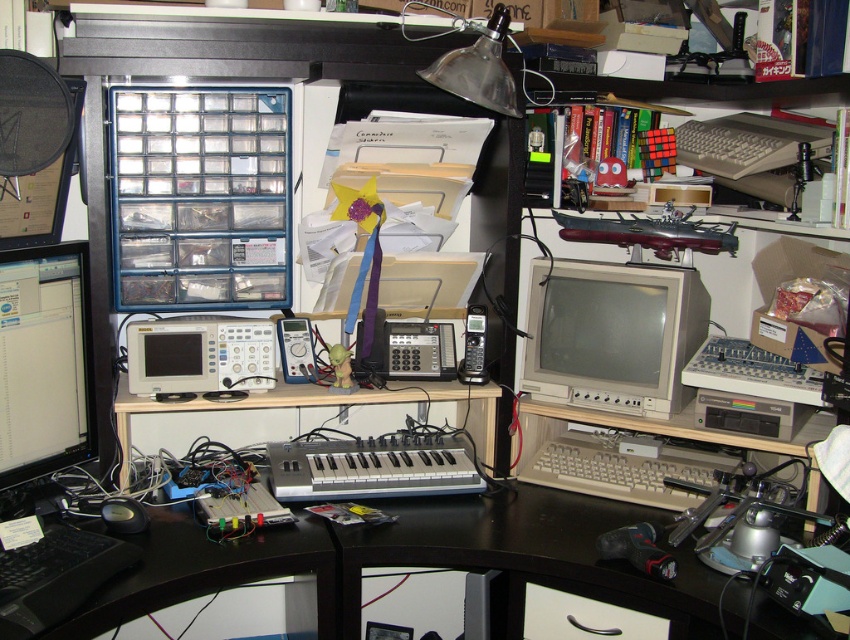
Is point (676, 317) in front of point (88, 289)?

No.

Which is above, beige plastic monitor at center or matte black monitor at left?

beige plastic monitor at center is above.

Is point (633, 300) positioned in front of point (85, 371)?

No.

Locate an element on the screen. The width and height of the screenshot is (850, 640). beige plastic monitor at center is located at coordinates (613, 333).

From the picture: Between beige plastic monitor at center and beige plastic keyboard at lower center, which one appears on the left side from the viewer's perspective?

beige plastic monitor at center is more to the left.

You are a GUI agent. You are given a task and a screenshot of the screen. Output one action in this format:
    pyautogui.click(x=<x>, y=<y>)
    Task: Click on the beige plastic monitor at center
    This screenshot has height=640, width=850.
    Given the screenshot: What is the action you would take?
    pyautogui.click(x=613, y=333)

At what (x,y) coordinates should I click in order to perform the action: click on beige plastic monitor at center. Please return your answer as a coordinate pair (x, y). Looking at the image, I should click on (613, 333).

Is point (0, 268) closer to viewer compared to point (677, 490)?

Yes, it is.

Between point (78, 352) and point (550, 484), which one is positioned behind?

The point (550, 484) is more distant.

Between point (41, 470) and point (573, 449), which one is positioned behind?

The point (573, 449) is more distant.

Where is `matte black monitor at left`? Image resolution: width=850 pixels, height=640 pixels. matte black monitor at left is located at coordinates (44, 362).